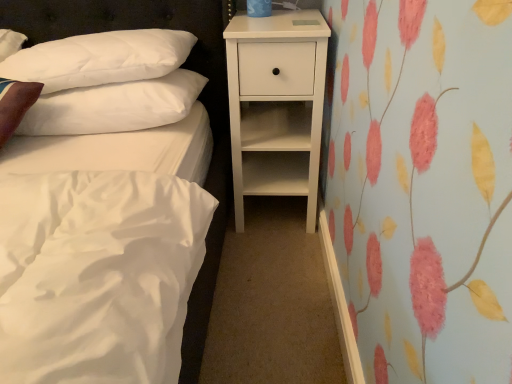
Question: From a real-world perspective, is white soft pillow at upper left, which is the 2th pillow in top-to-bottom order, below white soft pillow at upper left, acting as the 1th pillow starting from the top?

Choices:
 (A) no
 (B) yes

Answer: (B)

Question: Is white soft pillow at upper left, which is the 2th pillow in top-to-bottom order, thinner than white soft pillow at upper left, marked as the second pillow in a bottom-to-top arrangement?

Choices:
 (A) yes
 (B) no

Answer: (B)

Question: Is white soft pillow at upper left, which is the 2th pillow in top-to-bottom order, facing towards white soft pillow at upper left, marked as the second pillow in a bottom-to-top arrangement?

Choices:
 (A) no
 (B) yes

Answer: (A)

Question: From the image's perspective, is white soft pillow at upper left, positioned as the first pillow in bottom-to-top order, over white soft pillow at upper left, acting as the 1th pillow starting from the top?

Choices:
 (A) yes
 (B) no

Answer: (B)

Question: Considering the relative sizes of white soft pillow at upper left, which is the 2th pillow in top-to-bottom order, and white soft pillow at upper left, marked as the second pillow in a bottom-to-top arrangement, in the image provided, is white soft pillow at upper left, which is the 2th pillow in top-to-bottom order, smaller than white soft pillow at upper left, marked as the second pillow in a bottom-to-top arrangement,?

Choices:
 (A) yes
 (B) no

Answer: (A)

Question: Is point (130, 119) positioned closer to the camera than point (262, 16)?

Choices:
 (A) farther
 (B) closer

Answer: (B)

Question: Considering the positions of white soft pillow at upper left, which is the 2th pillow in top-to-bottom order, and white matte nightstand at center in the image, is white soft pillow at upper left, which is the 2th pillow in top-to-bottom order, bigger or smaller than white matte nightstand at center?

Choices:
 (A) big
 (B) small

Answer: (B)

Question: In the image, is white soft pillow at upper left, positioned as the first pillow in bottom-to-top order, on the left side or the right side of white matte nightstand at center?

Choices:
 (A) right
 (B) left

Answer: (B)

Question: Do you think white soft pillow at upper left, positioned as the first pillow in bottom-to-top order, is within white matte nightstand at center, or outside of it?

Choices:
 (A) outside
 (B) inside

Answer: (A)

Question: Based on their positions, is white soft pillow at upper left, marked as the second pillow in a bottom-to-top arrangement, located to the left or right of white matte nightstand at center?

Choices:
 (A) right
 (B) left

Answer: (B)

Question: In terms of height, does white soft pillow at upper left, marked as the second pillow in a bottom-to-top arrangement, look taller or shorter compared to white matte nightstand at center?

Choices:
 (A) short
 (B) tall

Answer: (A)

Question: Looking at their shapes, would you say white soft pillow at upper left, acting as the 1th pillow starting from the top, is wider or thinner than white matte nightstand at center?

Choices:
 (A) wide
 (B) thin

Answer: (B)

Question: Is white soft pillow at upper left, acting as the 1th pillow starting from the top, bigger or smaller than white matte nightstand at center?

Choices:
 (A) small
 (B) big

Answer: (A)

Question: In terms of height, does white matte nightstand at center look taller or shorter compared to white soft pillow at upper left, marked as the second pillow in a bottom-to-top arrangement?

Choices:
 (A) short
 (B) tall

Answer: (B)

Question: From a real-world perspective, is white matte nightstand at center positioned above or below white soft pillow at upper left, marked as the second pillow in a bottom-to-top arrangement?

Choices:
 (A) below
 (B) above

Answer: (A)